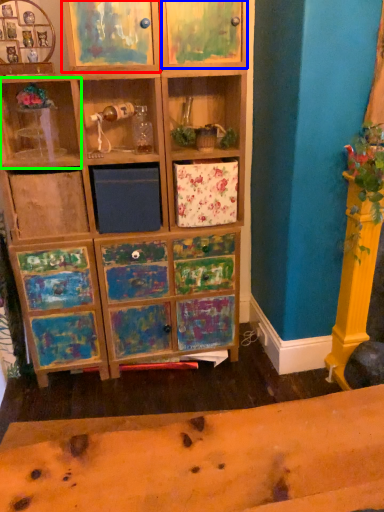
Question: Based on their relative distances, which object is nearer to cabinet (highlighted by a red box)? Choose from cabinet (highlighted by a blue box) and shelf (highlighted by a green box).

Choices:
 (A) cabinet
 (B) shelf

Answer: (A)